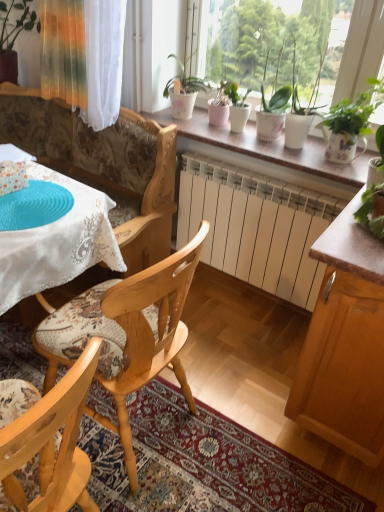
Question: In terms of width, does light wood chair at center, positioned as the 1th chair in front-to-back order, look wider or thinner when compared to matte white pot at center, which ranks as the 2th houseplant in bottom-to-top order?

Choices:
 (A) thin
 (B) wide

Answer: (B)

Question: Considering their positions, is light wood chair at center, positioned as the 1th chair in front-to-back order, located in front of or behind matte white pot at center, arranged as the second houseplant when viewed from the right?

Choices:
 (A) behind
 (B) front

Answer: (B)

Question: Which is nearer to the light wood chair at center, the first chair in the back-to-front sequence?

Choices:
 (A) blue textured paper plate at upper left
 (B) translucent glass vase at upper left, positioned as the 3th houseplant in bottom-to-top order
 (C) white lace tablecloth at upper left
 (D) matte brown cabinet at right
 (E) white ceramic pots at center

Answer: (C)

Question: Which of these objects is positioned closest to the blue textured paper plate at upper left?

Choices:
 (A) light wood chair at center, which appears as the second chair when viewed from the back
 (B) light wood chair at center, which ranks as the second chair in front-to-back order
 (C) matte brown cabinet at right
 (D) white lace tablecloth at upper left
 (E) matte white pot at center, positioned as the 2th houseplant in front-to-back order

Answer: (D)